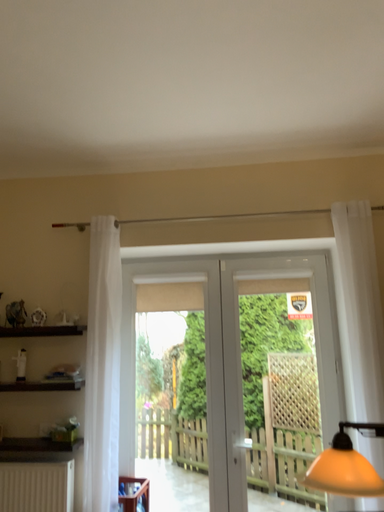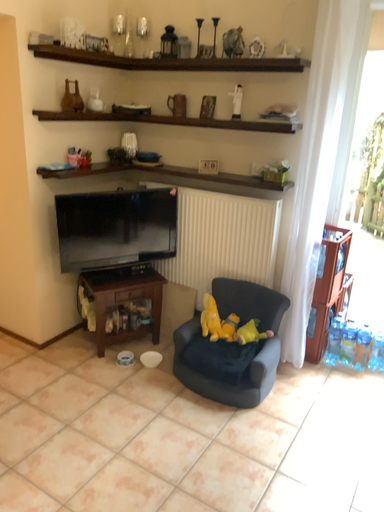
Question: How did the camera likely rotate when shooting the video?

Choices:
 (A) rotated left
 (B) rotated right

Answer: (A)